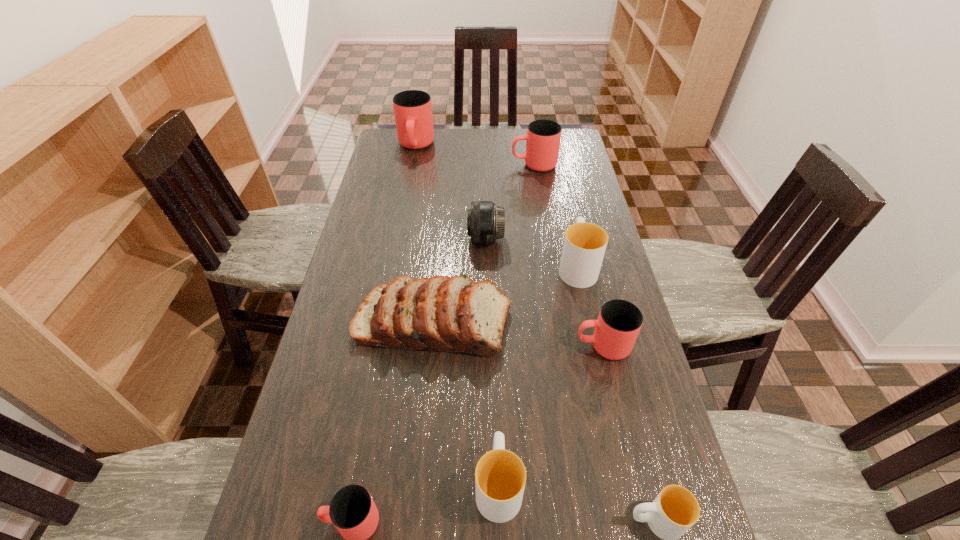
Identify the location of object that is at the far left corner. The width and height of the screenshot is (960, 540). (413, 110).

Where is `object positioned at the far right corner`? The image size is (960, 540). object positioned at the far right corner is located at coordinates (543, 136).

Find the location of a particular element. This screenshot has width=960, height=540. free location at the far edge is located at coordinates (513, 133).

The width and height of the screenshot is (960, 540). In the image, there is a desktop. In order to click on vacant area at the left edge in this screenshot , I will do `click(355, 241)`.

Locate an element on the screen. free spot at the right edge of the desktop is located at coordinates (667, 450).

Image resolution: width=960 pixels, height=540 pixels. In the image, there is a desktop. Find the location of `free space at the far left corner`. free space at the far left corner is located at coordinates coord(396,134).

Image resolution: width=960 pixels, height=540 pixels. What are the coordinates of `blank region between the tallest cup and the telephoto lens` in the screenshot? It's located at (450, 193).

In order to click on vacant space in between the second biggest yellow cup and the telephoto lens in this screenshot , I will do `click(492, 361)`.

Where is `free spot between the second smallest pink cup and the second smallest yellow cup`? The width and height of the screenshot is (960, 540). free spot between the second smallest pink cup and the second smallest yellow cup is located at coordinates (550, 415).

Find the location of `empty space between the telephoto lens and the third farthest pink cup`. empty space between the telephoto lens and the third farthest pink cup is located at coordinates (544, 293).